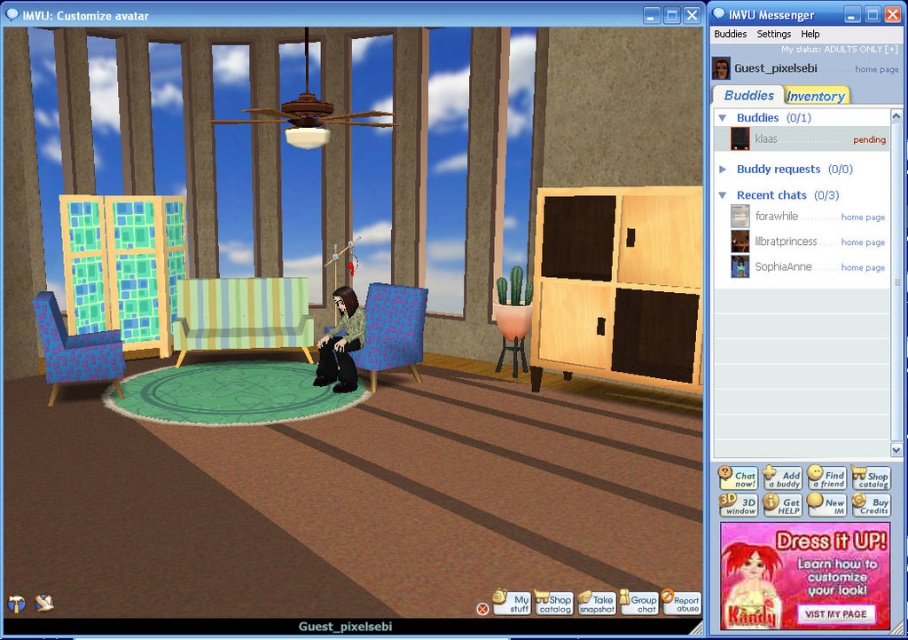
Question: Observing the image, what is the correct spatial positioning of wooden cabinet at right in reference to green striped fabric armchair at center?

Choices:
 (A) below
 (B) above

Answer: (B)

Question: Which point appears closest to the camera in this image?

Choices:
 (A) (334, 333)
 (B) (668, 332)
 (C) (400, 323)
 (D) (47, 340)

Answer: (B)

Question: Which object appears closest to the camera in this image?

Choices:
 (A) green striped fabric armchair at center
 (B) blue pixelated armchair at left
 (C) matte blue fabric armchair at center

Answer: (B)

Question: Is the position of green striped fabric armchair at center less distant than that of matte blue fabric armchair at center?

Choices:
 (A) yes
 (B) no

Answer: (B)

Question: Which object appears farthest from the camera in this image?

Choices:
 (A) green fuzzy sweater at center
 (B) green striped fabric armchair at center
 (C) blue pixelated armchair at left
 (D) wooden cabinet at right

Answer: (B)

Question: Does wooden cabinet at right appear on the left side of green striped fabric armchair at center?

Choices:
 (A) no
 (B) yes

Answer: (A)